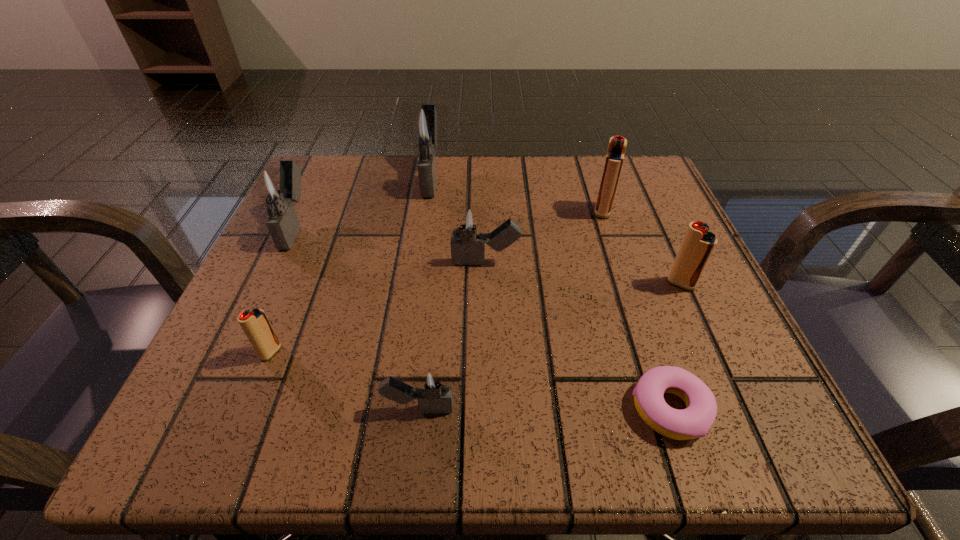
Where is `the second closest red igniter to the second igniter from right to left`? the second closest red igniter to the second igniter from right to left is located at coordinates (255, 324).

Select which red igniter appears as the second closest to the third smallest gray igniter. Please provide its 2D coordinates. Your answer should be formatted as a tuple, i.e. [(x, y)], where the tuple contains the x and y coordinates of a point satisfying the conditions above.

[(617, 145)]

In order to click on blank area in the image that satisfies the following two spatial constraints: 1. on the back side of the third smallest gray igniter; 2. on the right side of the farthest red igniter in this screenshot , I will do `click(303, 211)`.

At what (x,y) coordinates should I click in order to perform the action: click on vacant space that satisfies the following two spatial constraints: 1. on the front side of the shortest object; 2. on the right side of the second biggest gray igniter. Please return your answer as a coordinate pair (x, y). This screenshot has width=960, height=540. Looking at the image, I should click on (210, 409).